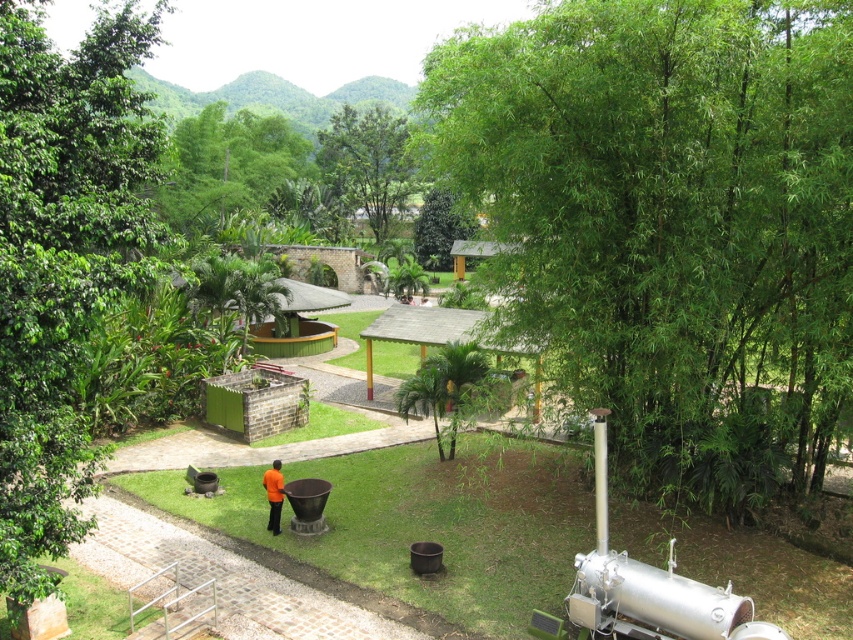
Does green leafy bamboo at right appear on the right side of green leafy tree at upper left?

Yes, green leafy bamboo at right is to the right of green leafy tree at upper left.

Does green leafy bamboo at right appear over green leafy tree at upper left?

Incorrect, green leafy bamboo at right is not positioned above green leafy tree at upper left.

What do you see at coordinates (671, 224) in the screenshot? The height and width of the screenshot is (640, 853). I see `green leafy bamboo at right` at bounding box center [671, 224].

Find the location of a particular element. The width and height of the screenshot is (853, 640). green leafy bamboo at right is located at coordinates (671, 224).

Is green leafy bamboo at right closer to camera compared to green leafy tree at left?

No.

Is point (619, 144) positioned before point (44, 182)?

No, (619, 144) is behind (44, 182).

This screenshot has width=853, height=640. Find the location of `green leafy bamboo at right`. green leafy bamboo at right is located at coordinates (671, 224).

From the picture: Can you confirm if green leafy bamboo at right is thinner than orange fabric shirt at center?

In fact, green leafy bamboo at right might be wider than orange fabric shirt at center.

Which is in front, point (799, 22) or point (276, 504)?

Point (799, 22)

Image resolution: width=853 pixels, height=640 pixels. In order to click on green leafy bamboo at right in this screenshot , I will do `click(671, 224)`.